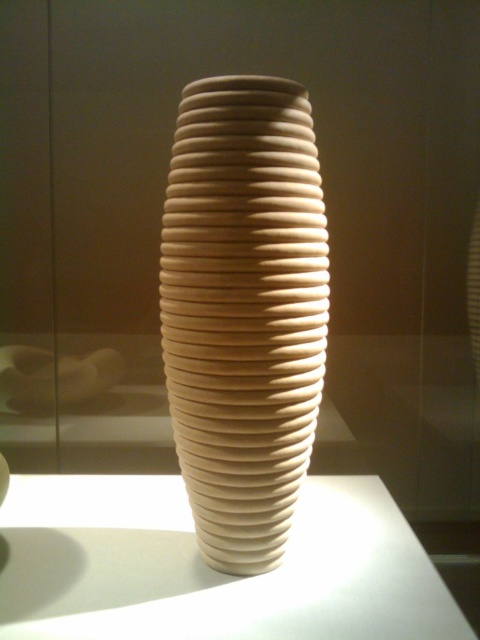
You are arranging flowers in the matte beige vase at center and need to place it on the white matte table at center. Based on the scene, will the vase fit entirely on the table?

The matte beige vase at center occupies less space than the white matte table at center, so yes, the vase will fit entirely on the table.

You are arranging flowers in the matte beige vase at center. The table you are using is the white matte table at center. If the vase is narrower than the table, will it fit stably on the table?

The matte beige vase at center is narrower than the white matte table at center, so it will fit stably on the table since its width is less than the table.